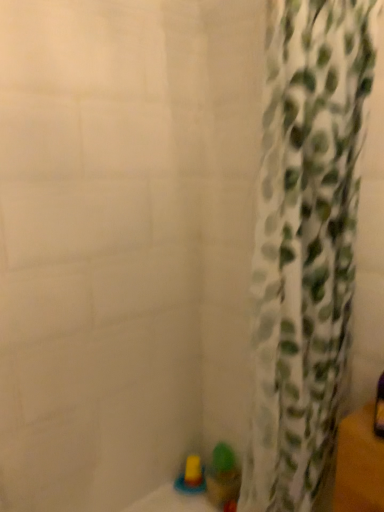
Question: In terms of size, does translucent yellow toy at lower center, which is counted as the 1th toy, starting from the left, appear bigger or smaller than translucent plastic cup at lower center, arranged as the first toy when viewed from the right?

Choices:
 (A) big
 (B) small

Answer: (B)

Question: Would you say translucent yellow toy at lower center, which is counted as the 1th toy, starting from the left, is inside or outside translucent plastic cup at lower center, arranged as the first toy when viewed from the right?

Choices:
 (A) inside
 (B) outside

Answer: (B)

Question: Which object is the closest to the translucent yellow toy at lower center, which is counted as the 1th toy, starting from the left?

Choices:
 (A) translucent plastic cup at lower center, the second toy viewed from the left
 (B) white fabric curtain at right

Answer: (A)

Question: Estimate the real-world distances between objects in this image. Which object is farther from the translucent yellow toy at lower center, the 2th toy from the right?

Choices:
 (A) white fabric curtain at right
 (B) translucent plastic cup at lower center, the second toy viewed from the left

Answer: (A)